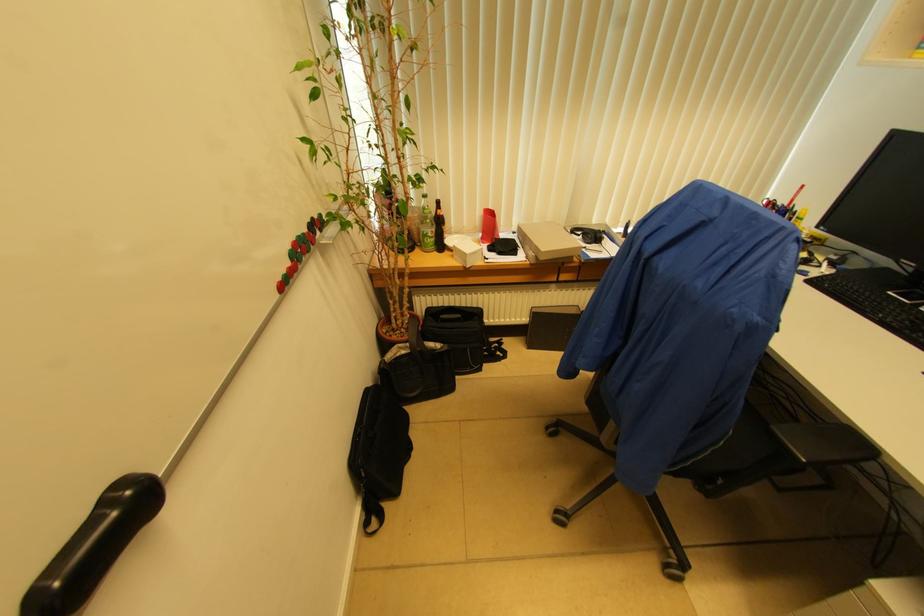
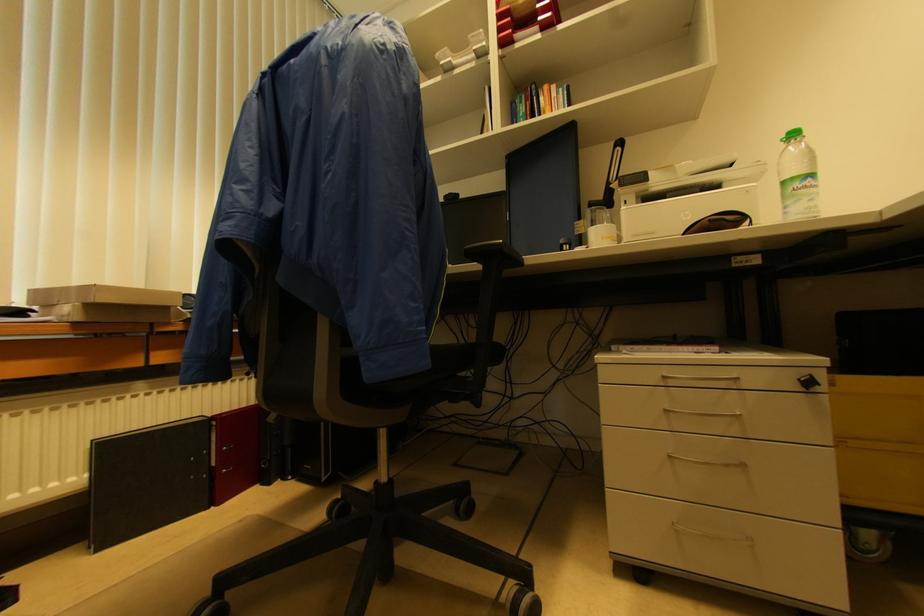
The first image is from the beginning of the video and the second image is from the end. How did the camera likely rotate when shooting the video?

The camera rotated toward right-up.